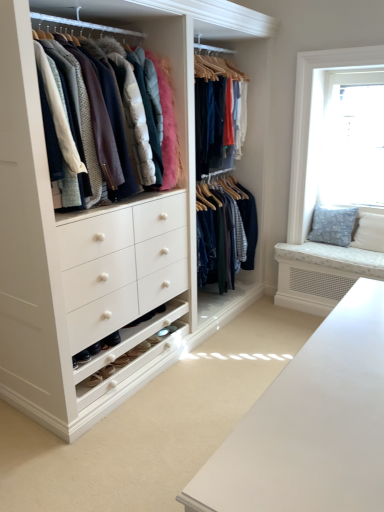
Locate an element on the screen. Image resolution: width=384 pixels, height=512 pixels. blue textured cushion at right is located at coordinates (333, 225).

At what (x,y) coordinates should I click in order to perform the action: click on blue textured cushion at right. Please return your answer as a coordinate pair (x, y). The height and width of the screenshot is (512, 384). Looking at the image, I should click on (333, 225).

Does blue textured cushion at right appear on the left side of transparent glass window at upper right?

Yes, blue textured cushion at right is to the left of transparent glass window at upper right.

Does blue textured cushion at right have a lesser width compared to transparent glass window at upper right?

No, blue textured cushion at right is not thinner than transparent glass window at upper right.

Considering the positions of point (344, 243) and point (330, 108), is point (344, 243) closer or farther from the camera than point (330, 108)?

Point (344, 243) is farther from the camera than point (330, 108).

Is point (339, 101) closer to camera compared to point (132, 170)?

No.

Looking at this image, considering the relative positions of transparent glass window at upper right and matte white coat rack at upper left in the image provided, is transparent glass window at upper right to the left of matte white coat rack at upper left from the viewer's perspective?

In fact, transparent glass window at upper right is to the right of matte white coat rack at upper left.

Considering the sizes of objects transparent glass window at upper right and matte white coat rack at upper left in the image provided, who is thinner, transparent glass window at upper right or matte white coat rack at upper left?

With smaller width is transparent glass window at upper right.

Between matte white coat rack at upper left and transparent glass window at upper right, which one has smaller width?

transparent glass window at upper right is thinner.

Locate an element on the screen. closet above the transparent glass window at upper right (from a real-world perspective) is located at coordinates (112, 106).

In the scene shown: Is matte white coat rack at upper left directly adjacent to transparent glass window at upper right?

They are not placed beside each other.

Can we say matte white coat rack at upper left lies outside transparent glass window at upper right?

Yes, matte white coat rack at upper left is outside of transparent glass window at upper right.

How many degrees apart are the facing directions of blue textured cushion at right and matte white coat rack at upper left?

The facing directions of blue textured cushion at right and matte white coat rack at upper left are 88.3 degrees apart.

Is blue textured cushion at right oriented towards matte white coat rack at upper left?

No, blue textured cushion at right is not oriented towards matte white coat rack at upper left.

From the image's perspective, is blue textured cushion at right located above matte white coat rack at upper left?

No, from the image's perspective, blue textured cushion at right is not over matte white coat rack at upper left.

From a real-world perspective, relative to matte white coat rack at upper left, is blue textured cushion at right vertically above or below?

From a real-world perspective, blue textured cushion at right is physically below matte white coat rack at upper left.

Does matte white coat rack at upper left have a greater height compared to blue textured cushion at right?

Correct, matte white coat rack at upper left is much taller as blue textured cushion at right.

Is matte white coat rack at upper left bigger or smaller than blue textured cushion at right?

Considering their sizes, matte white coat rack at upper left takes up more space than blue textured cushion at right.

Consider the image. What's the angular difference between matte white coat rack at upper left and blue textured cushion at right's facing directions?

The facing directions of matte white coat rack at upper left and blue textured cushion at right are 88.3 degrees apart.

Looking at this image, which of these two, matte white coat rack at upper left or blue textured cushion at right, is wider?

Wider between the two is matte white coat rack at upper left.

Which point is more distant from viewer, (350,202) or (357,208)?

The point (350,202) is farther from the camera.

Relative to blue textured cushion at right, is transparent glass window at upper right in front or behind?

transparent glass window at upper right is positioned closer to the viewer than blue textured cushion at right.

Can you confirm if transparent glass window at upper right is smaller than blue textured cushion at right?

No, transparent glass window at upper right is not smaller than blue textured cushion at right.

Does transparent glass window at upper right have a greater height compared to blue textured cushion at right?

Yes.

At what (x,y) coordinates should I click in order to perform the action: click on bay window in front of the blue textured cushion at right. Please return your answer as a coordinate pair (x, y). The width and height of the screenshot is (384, 512). Looking at the image, I should click on (352, 139).

Locate an element on the screen. bay window above the matte white coat rack at upper left (from the image's perspective) is located at coordinates (352, 139).

Looking at the image, which one is located closer to blue textured cushion at right, transparent glass window at upper right or matte white coat rack at upper left?

Based on the image, transparent glass window at upper right appears to be nearer to blue textured cushion at right.

Looking at the image, which one is located further to transparent glass window at upper right, matte white coat rack at upper left or blue textured cushion at right?

Among the two, matte white coat rack at upper left is located further to transparent glass window at upper right.

Based on their spatial positions, is transparent glass window at upper right or blue textured cushion at right further from matte white coat rack at upper left?

blue textured cushion at right lies further to matte white coat rack at upper left than the other object.

Looking at the image, which one is located closer to transparent glass window at upper right, blue textured cushion at right or matte white coat rack at upper left?

blue textured cushion at right is closer to transparent glass window at upper right.

Estimate the real-world distances between objects in this image. Which object is closer to matte white coat rack at upper left, blue textured cushion at right or transparent glass window at upper right?

transparent glass window at upper right lies closer to matte white coat rack at upper left than the other object.

Which object lies nearer to the anchor point blue textured cushion at right, matte white coat rack at upper left or transparent glass window at upper right?

Based on the image, transparent glass window at upper right appears to be nearer to blue textured cushion at right.

This screenshot has width=384, height=512. In order to click on pillow situated between matte white coat rack at upper left and transparent glass window at upper right from left to right in this screenshot , I will do `click(333, 225)`.